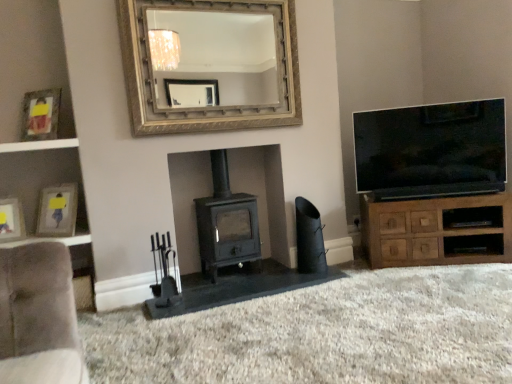
In order to face matte gold picture frame at left, the second picture frame ordered from the bottom, should I rotate leftwards or rightwards?

To face it directly, rotate left by 24.648 degrees.

Measure the distance between flat-screen tv at right and camera.

flat-screen tv at right and camera are 3.08 meters apart from each other.

Describe the element at coordinates (431, 150) in the screenshot. I see `flat-screen tv at right` at that location.

What do you see at coordinates (227, 223) in the screenshot? The height and width of the screenshot is (384, 512). I see `matte black wood burning stove at center` at bounding box center [227, 223].

Describe the element at coordinates (39, 145) in the screenshot. The image size is (512, 384). I see `white glossy shelf at left` at that location.

At what (x,y) coordinates should I click in order to perform the action: click on matte gold picture frame at left, the second picture frame ordered from the bottom. Please return your answer as a coordinate pair (x, y). The height and width of the screenshot is (384, 512). Looking at the image, I should click on 57,211.

Is white glossy shelf at left smaller than brown wood cabinet at right?

Correct, white glossy shelf at left occupies less space than brown wood cabinet at right.

From the image's perspective, is white glossy shelf at left under brown wood cabinet at right?

No, from the image's perspective, white glossy shelf at left is not beneath brown wood cabinet at right.

Considering the relative positions of white glossy shelf at left and brown wood cabinet at right in the image provided, is white glossy shelf at left to the right of brown wood cabinet at right from the viewer's perspective?

No, white glossy shelf at left is not to the right of brown wood cabinet at right.

Image resolution: width=512 pixels, height=384 pixels. I want to click on cabinetry that is behind the white glossy shelf at left, so click(x=437, y=230).

Considering the relative sizes of white glossy shelf at left and gold textured mirror at upper center in the image provided, is white glossy shelf at left wider than gold textured mirror at upper center?

Correct, the width of white glossy shelf at left exceeds that of gold textured mirror at upper center.

Between white glossy shelf at left and gold textured mirror at upper center, which one has more height?

gold textured mirror at upper center.

Is gold textured mirror at upper center located within white glossy shelf at left?

That's incorrect, gold textured mirror at upper center is not inside white glossy shelf at left.

From the image's perspective, between white glossy shelf at left and gold textured mirror at upper center, which one is located above?

gold textured mirror at upper center is shown above in the image.

Which of these two, matte black wood burning stove at center or matte black fireplace tools at center, is wider?

With larger width is matte black fireplace tools at center.

Where is `plain below the matte black wood burning stove at center (from a real-world perspective)`? The width and height of the screenshot is (512, 384). plain below the matte black wood burning stove at center (from a real-world perspective) is located at coordinates (323, 333).

Between matte black wood burning stove at center and matte black fireplace tools at center, which one appears on the left side from the viewer's perspective?

matte black wood burning stove at center is more to the left.

How far apart are matte gold picture frame at upper left, the third picture frame in the bottom-to-top sequence, and matte black wood burning stove at center?

matte gold picture frame at upper left, the third picture frame in the bottom-to-top sequence, and matte black wood burning stove at center are 1.29 meters apart.

From the image's perspective, which one is positioned higher, matte gold picture frame at upper left, placed as the first picture frame when sorted from top to bottom, or matte black wood burning stove at center?

matte gold picture frame at upper left, placed as the first picture frame when sorted from top to bottom.

From a real-world perspective, is matte gold picture frame at upper left, the third picture frame in the bottom-to-top sequence, positioned over matte black wood burning stove at center based on gravity?

Yes, from a real-world perspective, matte gold picture frame at upper left, the third picture frame in the bottom-to-top sequence, is above matte black wood burning stove at center.

Is matte gold picture frame at upper left, placed as the first picture frame when sorted from top to bottom, next to matte black wood burning stove at center and touching it?

No, matte gold picture frame at upper left, placed as the first picture frame when sorted from top to bottom, is not touching matte black wood burning stove at center.

Is white glossy shelf at left in front of or behind matte gold picture frame at upper left, the third picture frame in the bottom-to-top sequence, in the image?

white glossy shelf at left is positioned closer to the viewer than matte gold picture frame at upper left, the third picture frame in the bottom-to-top sequence.

From a real-world perspective, who is located higher, white glossy shelf at left or matte gold picture frame at upper left, the third picture frame in the bottom-to-top sequence?

matte gold picture frame at upper left, the third picture frame in the bottom-to-top sequence.

Is white glossy shelf at left shorter than matte gold picture frame at upper left, the third picture frame in the bottom-to-top sequence?

Yes, white glossy shelf at left is shorter than matte gold picture frame at upper left, the third picture frame in the bottom-to-top sequence.

Is point (55, 143) positioned in front of point (47, 136)?

Yes, it is in front of point (47, 136).

Can you confirm if white glossy shelf at left is thinner than matte black fireplace tools at center?

Indeed, white glossy shelf at left has a lesser width compared to matte black fireplace tools at center.

Looking at this image, from a real-world perspective, which is physically above, white glossy shelf at left or matte black fireplace tools at center?

white glossy shelf at left, from a real-world perspective.

Is the position of white glossy shelf at left more distant than that of matte black fireplace tools at center?

That is True.

From the image's perspective, would you say matte yellow picture frame at left, arranged as the third picture frame when viewed from the top, is positioned over gold textured mirror at upper center?

Incorrect, from the image's perspective, matte yellow picture frame at left, arranged as the third picture frame when viewed from the top, is lower than gold textured mirror at upper center.

Can you confirm if matte yellow picture frame at left, the 1th picture frame in the bottom-to-top sequence, is wider than gold textured mirror at upper center?

Yes.

Who is smaller, matte yellow picture frame at left, arranged as the third picture frame when viewed from the top, or gold textured mirror at upper center?

With smaller size is matte yellow picture frame at left, arranged as the third picture frame when viewed from the top.

This screenshot has width=512, height=384. Identify the location of shelf located above the brown wood cabinet at right (from a real-world perspective). (39, 145).

This screenshot has height=384, width=512. I want to click on mirror that appears on the right of white glossy shelf at left, so click(x=220, y=58).

Which object lies nearer to the anchor point matte black fireplace tools at center, black matte speaker at lower right or white glossy shelf at left?

black matte speaker at lower right is closer to matte black fireplace tools at center.

From the image, which object appears to be nearer to matte black wood burning stove at center, matte black fireplace tools at center or matte gold picture frame at left, the second picture frame ordered from the bottom?

Based on the image, matte black fireplace tools at center appears to be nearer to matte black wood burning stove at center.

When comparing their distances from matte black wood burning stove at center, does black matte speaker at lower right or white glossy shelf at left seem closer?

black matte speaker at lower right.

Looking at the image, which one is located further to brown wood cabinet at right, matte gold picture frame at upper left, the third picture frame in the bottom-to-top sequence, or white glossy shelf at left?

matte gold picture frame at upper left, the third picture frame in the bottom-to-top sequence, is positioned further to the anchor brown wood cabinet at right.

From the image, which object appears to be farther from matte gold picture frame at left, the second picture frame in the top-to-bottom sequence, matte black wood burning stove at center or matte black fireplace tools at center?

matte black fireplace tools at center is further to matte gold picture frame at left, the second picture frame in the top-to-bottom sequence.

Based on their spatial positions, is matte yellow picture frame at left, arranged as the third picture frame when viewed from the top, or flat-screen tv at right closer to matte black fireplace tools at center?

flat-screen tv at right.

From the image, which object appears to be nearer to white glossy shelf at left, brown wood cabinet at right or matte gold picture frame at upper left, the third picture frame in the bottom-to-top sequence?

matte gold picture frame at upper left, the third picture frame in the bottom-to-top sequence, lies closer to white glossy shelf at left than the other object.

Looking at the image, which one is located further to matte gold picture frame at upper left, placed as the first picture frame when sorted from top to bottom, gold textured mirror at upper center or matte black wood burning stove at center?

Among the two, gold textured mirror at upper center is located further to matte gold picture frame at upper left, placed as the first picture frame when sorted from top to bottom.

Image resolution: width=512 pixels, height=384 pixels. In order to click on shelf located between matte yellow picture frame at left, arranged as the third picture frame when viewed from the top, and matte black wood burning stove at center in the left-right direction in this screenshot , I will do `click(39, 145)`.

Where is `mirror between matte yellow picture frame at left, arranged as the third picture frame when viewed from the top, and brown wood cabinet at right`? mirror between matte yellow picture frame at left, arranged as the third picture frame when viewed from the top, and brown wood cabinet at right is located at coordinates (220, 58).

Where is `picture frame between matte gold picture frame at upper left, placed as the first picture frame when sorted from top to bottom, and black matte speaker at lower right, in the horizontal direction`? picture frame between matte gold picture frame at upper left, placed as the first picture frame when sorted from top to bottom, and black matte speaker at lower right, in the horizontal direction is located at coordinates click(57, 211).

Image resolution: width=512 pixels, height=384 pixels. In order to click on plain between matte yellow picture frame at left, the 1th picture frame in the bottom-to-top sequence, and brown wood cabinet at right, in the horizontal direction in this screenshot , I will do `click(323, 333)`.